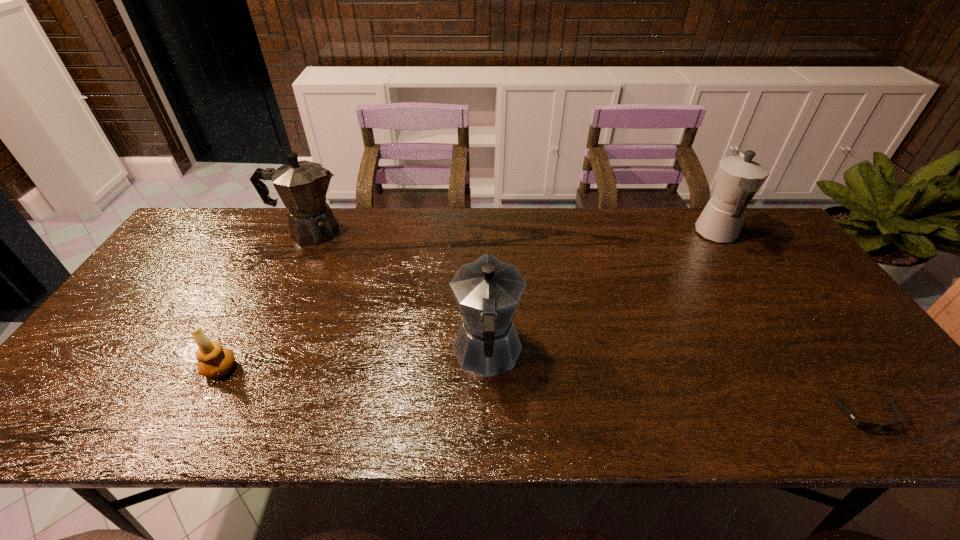
Find the location of `vacant space located at the spout of the third object from right to left`. vacant space located at the spout of the third object from right to left is located at coordinates 486,256.

The width and height of the screenshot is (960, 540). Identify the location of free space located 0.080m on the right of the fourth tallest object. (272, 368).

This screenshot has width=960, height=540. In order to click on object that is at the near edge in this screenshot , I will do `click(862, 425)`.

The width and height of the screenshot is (960, 540). I want to click on coffeepot present at the right edge, so click(739, 177).

Where is `sunglasses that is at the right edge`? sunglasses that is at the right edge is located at coordinates (862, 425).

Where is `object that is at the far right corner`? object that is at the far right corner is located at coordinates (739, 177).

Where is `object located at the near right corner`? The height and width of the screenshot is (540, 960). object located at the near right corner is located at coordinates (862, 425).

Locate an element on the screen. vacant space at the far edge of the desktop is located at coordinates (393, 211).

Locate an element on the screen. Image resolution: width=960 pixels, height=540 pixels. free space at the near edge is located at coordinates (603, 433).

At what (x,y) coordinates should I click in order to perform the action: click on free location at the left edge. Please return your answer as a coordinate pair (x, y). This screenshot has height=540, width=960. Looking at the image, I should click on (186, 283).